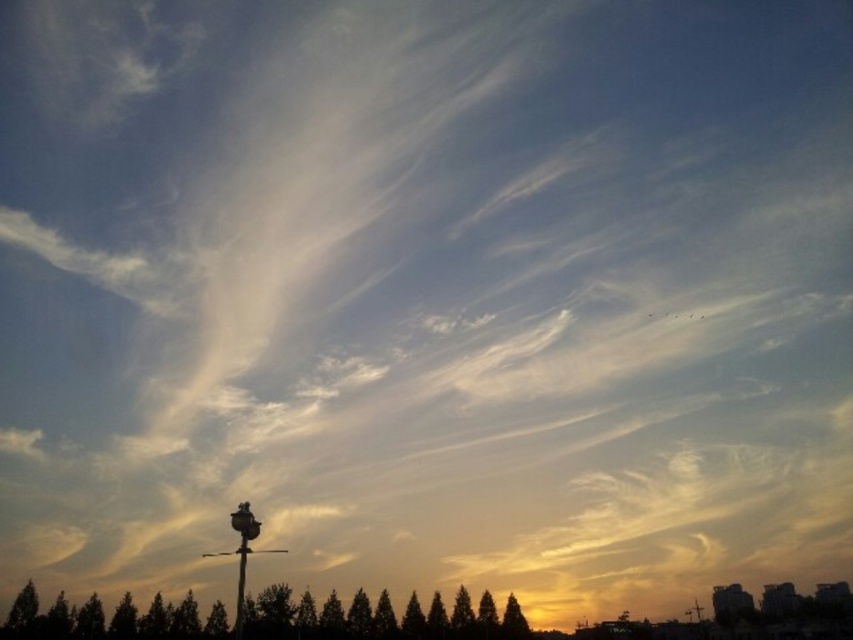
Question: Does green matte trees at lower center appear under satin black lamp post at lower center?

Choices:
 (A) yes
 (B) no

Answer: (A)

Question: Is green matte trees at lower center below metallic pole at center?

Choices:
 (A) no
 (B) yes

Answer: (B)

Question: Does satin black lamp post at lower center appear over metallic pole at center?

Choices:
 (A) no
 (B) yes

Answer: (A)

Question: Among these objects, which one is nearest to the camera?

Choices:
 (A) green matte tree at lower center
 (B) satin black lamp post at lower center
 (C) metallic pole at center
 (D) green matte trees at lower center

Answer: (B)

Question: Among these points, which one is nearest to the camera?

Choices:
 (A) (503, 636)
 (B) (328, 605)
 (C) (236, 618)
 (D) (218, 552)

Answer: (C)

Question: Which of the following is the closest to the observer?

Choices:
 (A) green matte tree at lower center
 (B) satin black lamp post at lower center

Answer: (B)